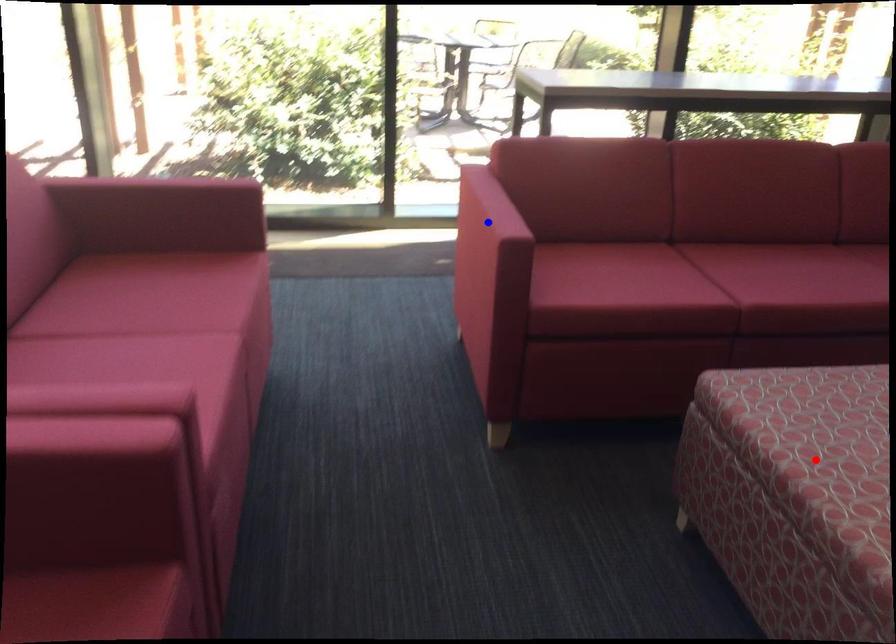
Question: Which of the two points in the image is closer to the camera?

Choices:
 (A) Blue point is closer.
 (B) Red point is closer.

Answer: (B)